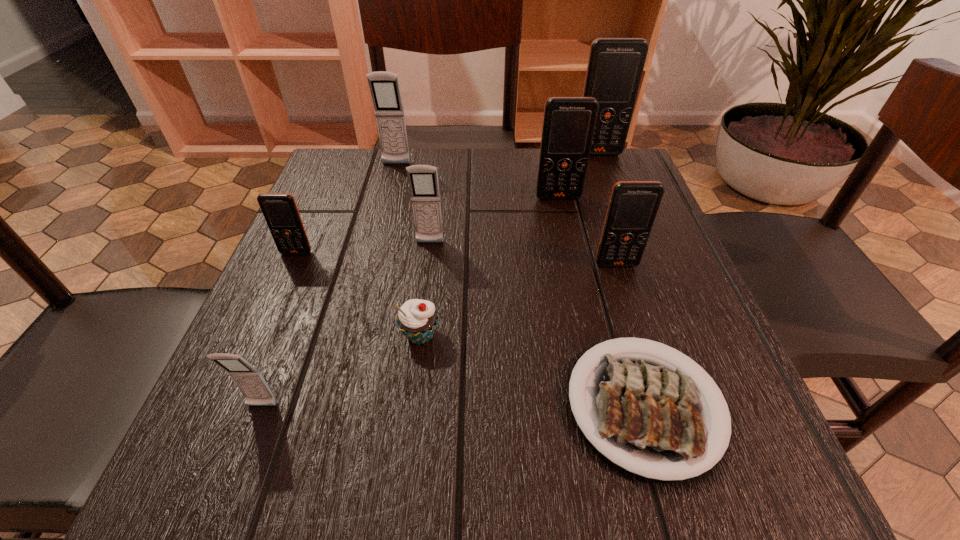
What are the coordinates of `vacant space at the near edge of the desktop` in the screenshot? It's located at pos(372,461).

Find the location of a particular element. The height and width of the screenshot is (540, 960). vacant region at the left edge of the desktop is located at coordinates (233, 390).

I want to click on free spot at the right edge of the desktop, so click(x=649, y=252).

This screenshot has width=960, height=540. In the image, there is a desktop. What are the coordinates of `free space at the far left corner` in the screenshot? It's located at (345, 197).

Find the location of a particular element. vacant point at the near left corner is located at coordinates [x=292, y=458].

The height and width of the screenshot is (540, 960). Find the location of `blank space at the far right corner`. blank space at the far right corner is located at coordinates [630, 163].

The image size is (960, 540). Find the location of `free space at the near right corner of the desktop`. free space at the near right corner of the desktop is located at coordinates (785, 497).

Locate an element on the screen. vacant region between the smallest orange cellular telephone and the second nearest cellular telephone is located at coordinates (457, 259).

The image size is (960, 540). I want to click on free space between the shortest object and the smallest orange cellular telephone, so click(470, 329).

You are a GUI agent. You are given a task and a screenshot of the screen. Output one action in this format:
    pyautogui.click(x=<x>, y=<y>)
    Task: Click on the free point between the second farthest gray cellular telephone and the fourth nearest object
    The width and height of the screenshot is (960, 540).
    Given the screenshot: What is the action you would take?
    pyautogui.click(x=523, y=254)